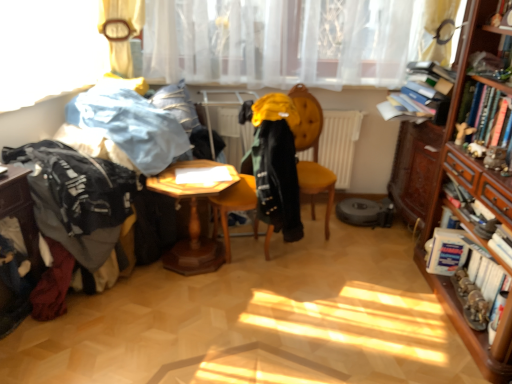
Find the location of `free space between yellow fabric swivel chair at center and wooden bookcase at right`. free space between yellow fabric swivel chair at center and wooden bookcase at right is located at coordinates (357, 294).